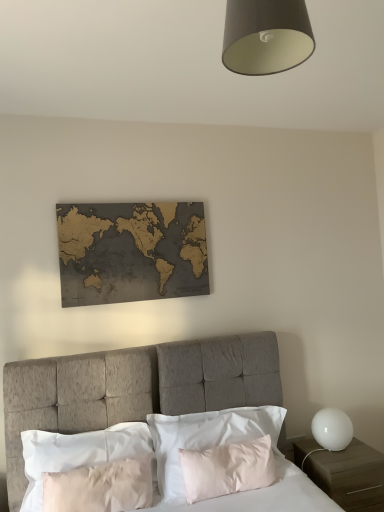
Question: Is gold-toned wood world map at upper center to the right of pale pink satin pillow at center, arranged as the first pillow when viewed from the left, from the viewer's perspective?

Choices:
 (A) yes
 (B) no

Answer: (A)

Question: Is gold-toned wood world map at upper center oriented towards pale pink satin pillow at center, arranged as the first pillow when viewed from the left?

Choices:
 (A) no
 (B) yes

Answer: (A)

Question: From the image's perspective, would you say gold-toned wood world map at upper center is shown under pale pink satin pillow at center, placed as the second pillow when sorted from right to left?

Choices:
 (A) yes
 (B) no

Answer: (B)

Question: Is gold-toned wood world map at upper center behind pale pink satin pillow at center, placed as the second pillow when sorted from right to left?

Choices:
 (A) yes
 (B) no

Answer: (A)

Question: From a real-world perspective, is gold-toned wood world map at upper center located higher than pale pink satin pillow at center, placed as the second pillow when sorted from right to left?

Choices:
 (A) no
 (B) yes

Answer: (B)

Question: Choose the correct answer: Is silky white pillow at center, the 1th pillow positioned from the right, inside pale pink satin pillow at center, arranged as the first pillow when viewed from the left, or outside it?

Choices:
 (A) inside
 (B) outside

Answer: (B)

Question: From a real-world perspective, relative to pale pink satin pillow at center, placed as the second pillow when sorted from right to left, is silky white pillow at center, the 1th pillow positioned from the right, vertically above or below?

Choices:
 (A) below
 (B) above

Answer: (A)

Question: Is silky white pillow at center, the 1th pillow positioned from the right, bigger or smaller than pale pink satin pillow at center, placed as the second pillow when sorted from right to left?

Choices:
 (A) big
 (B) small

Answer: (A)

Question: In the image, is silky white pillow at center, the 1th pillow positioned from the right, positioned in front of or behind pale pink satin pillow at center, arranged as the first pillow when viewed from the left?

Choices:
 (A) front
 (B) behind

Answer: (B)

Question: Choose the correct answer: Is silky white pillow at center, the 1th pillow positioned from the right, inside white matte nightstand at lower right or outside it?

Choices:
 (A) inside
 (B) outside

Answer: (B)

Question: Considering their positions, is silky white pillow at center, the 1th pillow positioned from the right, located in front of or behind white matte nightstand at lower right?

Choices:
 (A) behind
 (B) front

Answer: (B)

Question: Is silky white pillow at center, the 1th pillow positioned from the right, wider or thinner than white matte nightstand at lower right?

Choices:
 (A) wide
 (B) thin

Answer: (B)

Question: Does point (279, 426) appear closer or farther from the camera than point (340, 468)?

Choices:
 (A) farther
 (B) closer

Answer: (A)

Question: From the image's perspective, relative to white matte globe at right, is white matte nightstand at lower right above or below?

Choices:
 (A) below
 (B) above

Answer: (A)

Question: From a real-world perspective, relative to white matte globe at right, is white matte nightstand at lower right vertically above or below?

Choices:
 (A) below
 (B) above

Answer: (A)